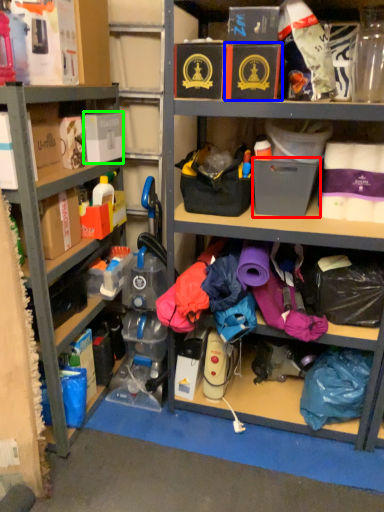
Question: Which object is positioned farthest from storage box (highlighted by a red box)? Select from storage box (highlighted by a blue box) and storage box (highlighted by a green box).

Choices:
 (A) storage box
 (B) storage box

Answer: (B)